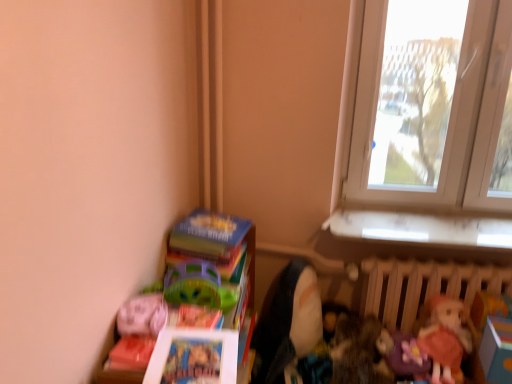
Question: Is matte plastic books at lower left facing away from matte pink plush at lower left?

Choices:
 (A) no
 (B) yes

Answer: (A)

Question: Considering the relative sizes of matte plastic books at lower left and matte pink plush at lower left in the image provided, is matte plastic books at lower left taller than matte pink plush at lower left?

Choices:
 (A) yes
 (B) no

Answer: (A)

Question: From the image's perspective, is matte plastic books at lower left under matte pink plush at lower left?

Choices:
 (A) no
 (B) yes

Answer: (B)

Question: Considering the relative sizes of matte plastic books at lower left and matte pink plush at lower left in the image provided, is matte plastic books at lower left wider than matte pink plush at lower left?

Choices:
 (A) no
 (B) yes

Answer: (B)

Question: Is matte plastic books at lower left outside of matte pink plush at lower left?

Choices:
 (A) yes
 (B) no

Answer: (A)

Question: Is matte pink plush at lower left to the left or to the right of hardcover book at lower left in the image?

Choices:
 (A) left
 (B) right

Answer: (A)

Question: From the image's perspective, is matte pink plush at lower left located above or below hardcover book at lower left?

Choices:
 (A) above
 (B) below

Answer: (B)

Question: Is point (131, 324) closer or farther from the camera than point (243, 226)?

Choices:
 (A) farther
 (B) closer

Answer: (B)

Question: Considering the positions of matte pink plush at lower left and hardcover book at lower left in the image, is matte pink plush at lower left taller or shorter than hardcover book at lower left?

Choices:
 (A) tall
 (B) short

Answer: (B)

Question: Considering the positions of matte plastic books at lower left and wooden radiator at lower right in the image, is matte plastic books at lower left taller or shorter than wooden radiator at lower right?

Choices:
 (A) tall
 (B) short

Answer: (A)

Question: From a real-world perspective, is matte plastic books at lower left above or below wooden radiator at lower right?

Choices:
 (A) above
 (B) below

Answer: (B)

Question: In the image, is matte plastic books at lower left positioned in front of or behind wooden radiator at lower right?

Choices:
 (A) behind
 (B) front

Answer: (B)

Question: Is point (184, 286) closer or farther from the camera than point (407, 291)?

Choices:
 (A) closer
 (B) farther

Answer: (A)

Question: In the image, is matte plastic books at lower left positioned in front of or behind hardcover book at lower left?

Choices:
 (A) behind
 (B) front

Answer: (B)

Question: Based on their sizes in the image, would you say matte plastic books at lower left is bigger or smaller than hardcover book at lower left?

Choices:
 (A) big
 (B) small

Answer: (A)